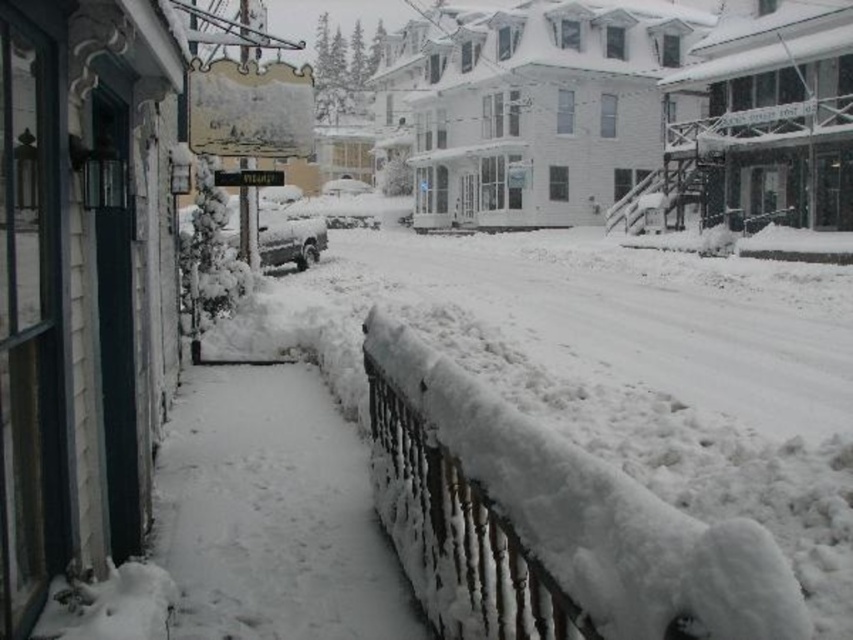
Is point (271, 572) farther from camera compared to point (225, 230)?

That is False.

Does white snow-covered pavement at lower left appear on the left side of snow-covered van at center?

No, white snow-covered pavement at lower left is not to the left of snow-covered van at center.

Based on the photo, who is more forward, (190, 632) or (308, 257)?

Positioned in front is point (190, 632).

Where is `white snow-covered pavement at lower left`? The height and width of the screenshot is (640, 853). white snow-covered pavement at lower left is located at coordinates click(271, 515).

Does white snow-covered pavement at lower left have a lesser height compared to snow-covered metal railing at lower center?

Correct, white snow-covered pavement at lower left is not as tall as snow-covered metal railing at lower center.

Between white snow-covered pavement at lower left and snow-covered metal railing at lower center, which one is positioned higher?

snow-covered metal railing at lower center is higher up.

Describe the element at coordinates (271, 515) in the screenshot. The width and height of the screenshot is (853, 640). I see `white snow-covered pavement at lower left` at that location.

Find the location of a particular element. white snow-covered pavement at lower left is located at coordinates (271, 515).

Can you confirm if snow-covered metal railing at lower center is thinner than black metal sign at center?

Yes.

Can you confirm if snow-covered metal railing at lower center is shorter than black metal sign at center?

Incorrect, snow-covered metal railing at lower center's height does not fall short of black metal sign at center's.

I want to click on snow-covered metal railing at lower center, so click(x=463, y=532).